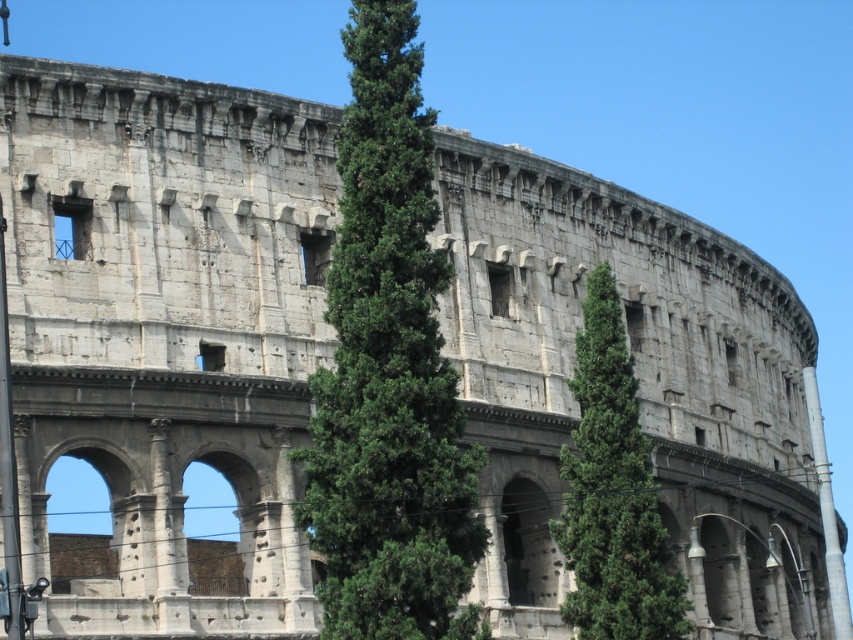
You are standing in front of the Colosseum and want to take a photo of both the green leafy tree at center and the green textured tree at center. Which tree should you focus on first to ensure both are in focus?

You should focus on the green leafy tree at center first because it is closer to you than the green textured tree at center, so adjusting focus from near to far will help both trees be in focus.

You are standing at the base of the Colosseum and want to reach the point marked at coordinates point (x=462, y=556). If your walking speed is 3 feet per second, how many seconds will it take you to reach that point?

The distance between you and point (x=462, y=556) is 149.61 feet. At a speed of 3 feet per second, it will take 149.61 divided by 3, which is approximately 49.87 seconds. So, about 50 seconds.

You are a visitor at the Colosseum and want to take a photo that includes both the green leafy tree at center and the green textured tree at center. Which tree should you focus on to ensure both are in the frame without moving your camera position?

You should focus on the green leafy tree at center because it is larger in size than the green textured tree at center, so keeping it centered will allow the smaller tree to fit within the frame as well.